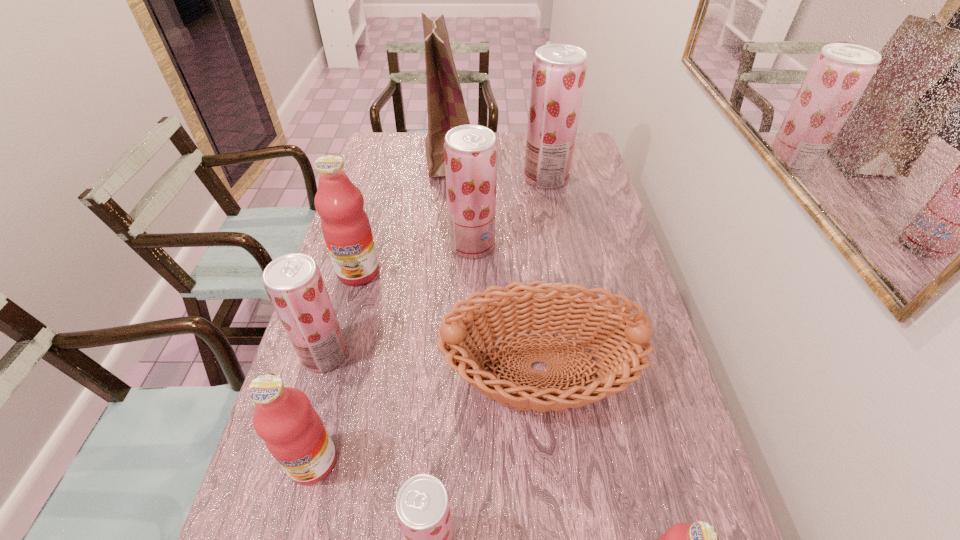
In the image, there is a desktop. Find the location of `free space at the right edge`. free space at the right edge is located at coordinates (633, 280).

This screenshot has width=960, height=540. In the image, there is a desktop. Find the location of `vacant space at the far left corner`. vacant space at the far left corner is located at coordinates (404, 142).

Identify the location of vacant space in between the farthest pink fruit juice and the second farthest strawberry fruit juice. Image resolution: width=960 pixels, height=540 pixels. (416, 259).

Find the location of a particular element. free space that is in between the farthest pink fruit juice and the second nearest strawberry fruit juice is located at coordinates (342, 313).

You are a GUI agent. You are given a task and a screenshot of the screen. Output one action in this format:
    pyautogui.click(x=<x>, y=<y>)
    Task: Click on the unoccupied area between the farthest strawberry fruit juice and the grocery bag
    This screenshot has width=960, height=540.
    Given the screenshot: What is the action you would take?
    pyautogui.click(x=499, y=167)

Choose which object is the nearest neighbor to the brown basket. Please provide its 2D coordinates. Your answer should be formatted as a tuple, i.e. [(x, y)], where the tuple contains the x and y coordinates of a point satisfying the conditions above.

[(422, 506)]

Choose which object is the seventh nearest neighbor to the third farthest strawberry fruit juice. Please provide its 2D coordinates. Your answer should be formatted as a tuple, i.e. [(x, y)], where the tuple contains the x and y coordinates of a point satisfying the conditions above.

[(700, 539)]

Select which fruit juice is the closest to the grocery bag. Please provide its 2D coordinates. Your answer should be formatted as a tuple, i.e. [(x, y)], where the tuple contains the x and y coordinates of a point satisfying the conditions above.

[(559, 70)]

Find the location of `fruit juice that is the sixth closest to the smallest strawberry fruit juice`. fruit juice that is the sixth closest to the smallest strawberry fruit juice is located at coordinates (559, 70).

Where is `strawberry fruit juice that stands as the fourth closest to the basket`? This screenshot has width=960, height=540. strawberry fruit juice that stands as the fourth closest to the basket is located at coordinates (559, 70).